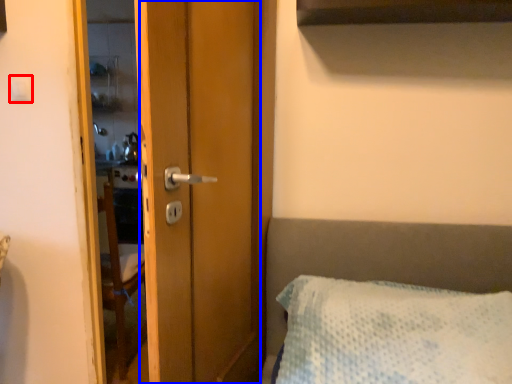
Question: Which object appears farthest to the camera in this image, light switch (highlighted by a red box) or screen door (highlighted by a blue box)?

Choices:
 (A) light switch
 (B) screen door

Answer: (A)